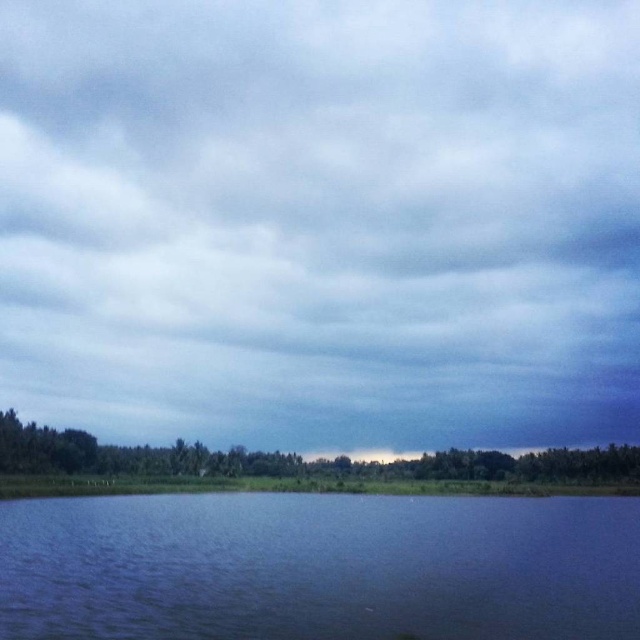
Question: Is cloudy sky at upper center bigger than green leafy trees at lower left?

Choices:
 (A) yes
 (B) no

Answer: (A)

Question: From the image, what is the correct spatial relationship of cloudy sky at upper center in relation to green leafy trees at lower left?

Choices:
 (A) below
 (B) above

Answer: (B)

Question: Estimate the real-world distances between objects in this image. Which object is farther from the cloudy sky at upper center?

Choices:
 (A) blue liquid water at bottom
 (B) green leafy trees at lower left

Answer: (A)

Question: Does cloudy sky at upper center have a greater width compared to blue liquid water at bottom?

Choices:
 (A) no
 (B) yes

Answer: (B)

Question: Considering the real-world distances, which object is farthest from the green leafy trees at lower left?

Choices:
 (A) cloudy sky at upper center
 (B) blue liquid water at bottom

Answer: (B)

Question: Among these points, which one is nearest to the camera?

Choices:
 (A) (65, 554)
 (B) (150, 376)

Answer: (A)